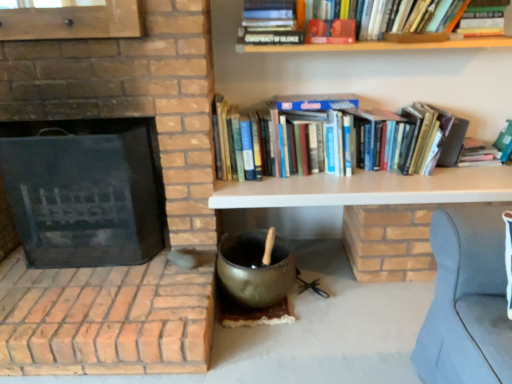
Question: Does white matte shelf at upper center have a lesser height compared to hardcover books at upper right?

Choices:
 (A) no
 (B) yes

Answer: (B)

Question: Is white matte shelf at upper center closer to the viewer compared to hardcover books at upper right?

Choices:
 (A) yes
 (B) no

Answer: (A)

Question: Is hardcover books at upper right surrounded by white matte shelf at upper center?

Choices:
 (A) no
 (B) yes

Answer: (A)

Question: From a real-world perspective, is white matte shelf at upper center located beneath hardcover books at upper right?

Choices:
 (A) yes
 (B) no

Answer: (A)

Question: Considering the relative sizes of white matte shelf at upper center and hardcover books at upper right in the image provided, is white matte shelf at upper center taller than hardcover books at upper right?

Choices:
 (A) yes
 (B) no

Answer: (B)

Question: Looking at their shapes, would you say black matte fireplace at left is wider or thinner than matte black wok at center?

Choices:
 (A) thin
 (B) wide

Answer: (B)

Question: Is black matte fireplace at left bigger or smaller than matte black wok at center?

Choices:
 (A) big
 (B) small

Answer: (A)

Question: Is black matte fireplace at left spatially inside matte black wok at center, or outside of it?

Choices:
 (A) outside
 (B) inside

Answer: (A)

Question: Is black matte fireplace at left taller or shorter than matte black wok at center?

Choices:
 (A) tall
 (B) short

Answer: (A)

Question: Do you think hardcover books at upper right is within black matte fireplace at left, or outside of it?

Choices:
 (A) inside
 (B) outside

Answer: (B)

Question: Visually, is hardcover books at upper right positioned to the left or to the right of black matte fireplace at left?

Choices:
 (A) right
 (B) left

Answer: (A)

Question: From the image's perspective, is hardcover books at upper right positioned above or below black matte fireplace at left?

Choices:
 (A) above
 (B) below

Answer: (A)

Question: From a real-world perspective, is hardcover books at upper right above or below black matte fireplace at left?

Choices:
 (A) above
 (B) below

Answer: (A)

Question: Based on their sizes in the image, would you say white matte shelf at upper center is bigger or smaller than black matte fireplace at left?

Choices:
 (A) big
 (B) small

Answer: (B)

Question: In the image, is white matte shelf at upper center on the left side or the right side of black matte fireplace at left?

Choices:
 (A) left
 (B) right

Answer: (B)